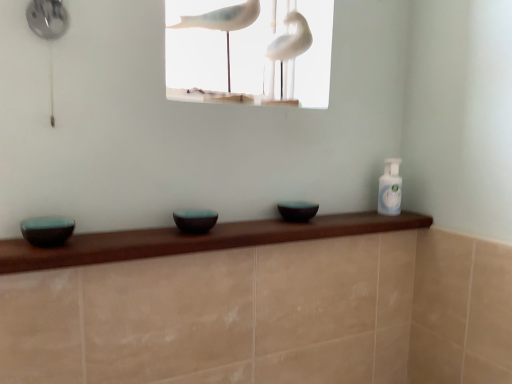
Question: From a real-world perspective, is white matte birds at upper center positioned above or below white glossy bird at upper center?

Choices:
 (A) above
 (B) below

Answer: (A)

Question: In terms of width, does white matte birds at upper center look wider or thinner when compared to white glossy bird at upper center?

Choices:
 (A) thin
 (B) wide

Answer: (B)

Question: Based on their relative distances, which object is farther from the teal glossy bowl at left, which is the third basin in back-to-front order?

Choices:
 (A) matte black bowl at center, which is counted as the 2th basin, starting from the left
 (B) white glossy bird at upper center
 (C) white matte birds at upper center
 (D) clear plastic bottle at upper right
 (E) matte black bowl at center, positioned as the 3th basin in left-to-right order

Answer: (C)

Question: Estimate the real-world distances between objects in this image. Which object is farther from the matte black bowl at center, which is counted as the 2th basin, starting from the left?

Choices:
 (A) clear plastic bottle at upper right
 (B) matte black bowl at center, which is the third basin in front-to-back order
 (C) white matte birds at upper center
 (D) teal glossy bowl at left, acting as the 1th basin starting from the left
 (E) white glossy bird at upper center

Answer: (C)